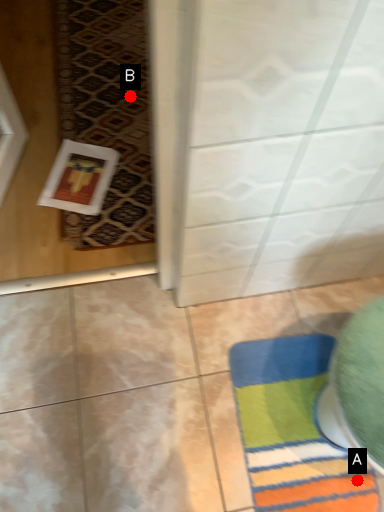
Question: Two points are circled on the image, labeled by A and B beside each circle. Among these points, which one is farthest from the camera?

Choices:
 (A) A is further
 (B) B is further

Answer: (B)